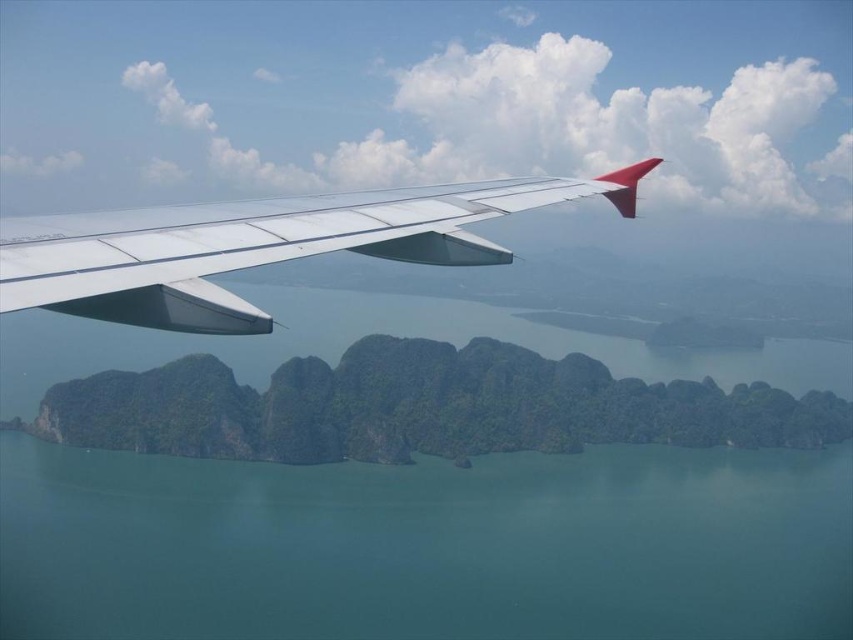
Consider the image. Does green smooth water at center have a larger size compared to metallic silver wing at upper left?

Yes.

How far apart are green smooth water at center and metallic silver wing at upper left?

green smooth water at center and metallic silver wing at upper left are 674.78 meters apart from each other.

Which is in front, point (621, 577) or point (520, 202)?

Point (520, 202) is in front.

You are a GUI agent. You are given a task and a screenshot of the screen. Output one action in this format:
    pyautogui.click(x=<x>, y=<y>)
    Task: Click on the green smooth water at center
    The width and height of the screenshot is (853, 640).
    Given the screenshot: What is the action you would take?
    pyautogui.click(x=426, y=545)